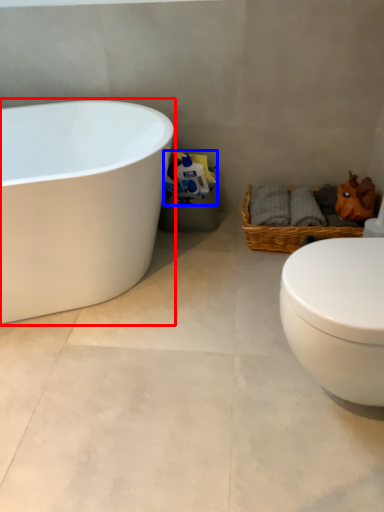
Question: Which object is closer to the camera taking this photo, bathtub (highlighted by a red box) or toilet paper (highlighted by a blue box)?

Choices:
 (A) bathtub
 (B) toilet paper

Answer: (A)